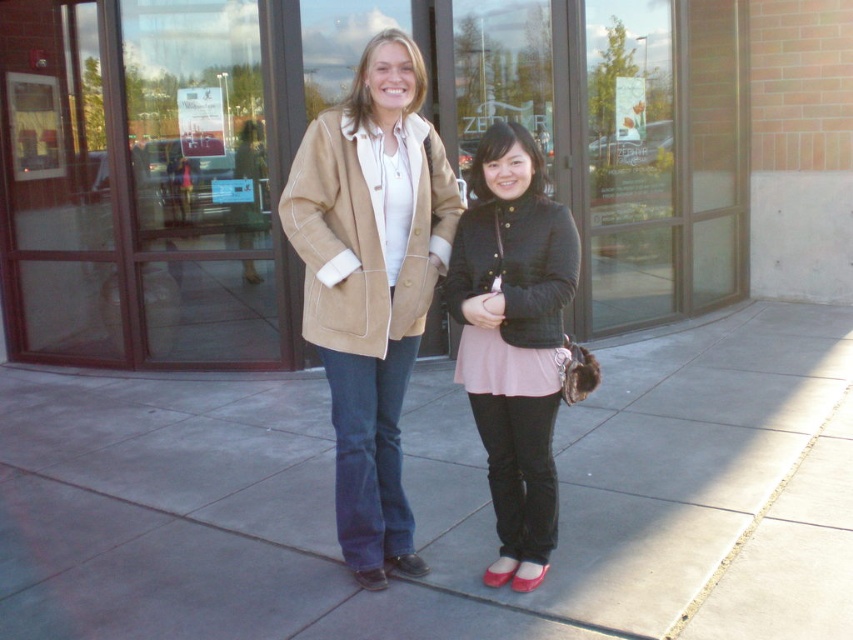
You are a photographer trying to capture both the matte black jacket at center and the tan suede coat at center in a single frame. Since the camera has a limited focus range, which clothing item should you focus on first to ensure it appears sharp, considering their sizes?

The matte black jacket at center is bigger than the tan suede coat at center, so focusing on the matte black jacket at center first will ensure it appears sharp within the camera focus range.

You are trying to find the person wearing the matte black jacket at center in the photo. According to the scene, where should you look relative to the tan suede coat at center?

The matte black jacket at center is positioned on the right side of tan suede coat at center, so you should look to the right of the tan suede coat at center to find the person wearing the matte black jacket at center.

You are standing at the point marked by the coordinates point (x=141, y=348) and want to walk to the glass doors in the background. If you can walk at a speed of 1.5 meters per second, how many seconds will it take you to reach the glass doors?

The distance between point (x=141, y=348) and the viewer is 6.07 meters. Since the glass doors are in the background where the viewer is facing, the distance to the glass doors would be approximately 6.07 meters. At a walking speed of 1.5 meters per second, it would take about 6.07 divided by 1.5, which is approximately 4.05 seconds. So, roughly 4 seconds.